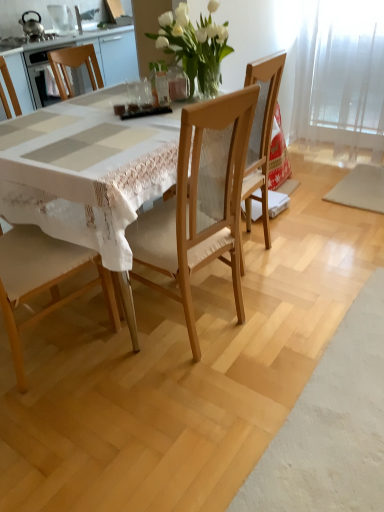
What do you see at coordinates (52, 282) in the screenshot? I see `white fabric chair at left, the second chair when ordered from right to left` at bounding box center [52, 282].

The height and width of the screenshot is (512, 384). I want to click on transparent glass door at upper right, so click(340, 76).

Describe the element at coordinates (61, 17) in the screenshot. The height and width of the screenshot is (512, 384). I see `brushed metal kettle at upper left, which is the first appliance in right-to-left order` at that location.

At what (x,y) coordinates should I click in order to perform the action: click on wooden chair at center, positioned as the 2th chair in left-to-right order. Please return your answer as a coordinate pair (x, y). Looking at the image, I should click on (261, 134).

I want to click on wooden table at center, so click(x=86, y=170).

Is point (302, 99) in front of point (57, 27)?

Yes, point (302, 99) is in front of point (57, 27).

Consider the image. Is transparent glass door at upper right positioned far away from brushed metal kettle at upper left, marked as the second appliance in a left-to-right arrangement?

transparent glass door at upper right is far away from brushed metal kettle at upper left, marked as the second appliance in a left-to-right arrangement.

From a real-world perspective, is transparent glass door at upper right over brushed metal kettle at upper left, marked as the second appliance in a left-to-right arrangement?

No, from a real-world perspective, transparent glass door at upper right is not above brushed metal kettle at upper left, marked as the second appliance in a left-to-right arrangement.

Considering the sizes of objects transparent glass door at upper right and brushed metal kettle at upper left, which is the first appliance in right-to-left order, in the image provided, who is thinner, transparent glass door at upper right or brushed metal kettle at upper left, which is the first appliance in right-to-left order,?

transparent glass door at upper right.

From a real-world perspective, is clear glass at center located beneath white glass vase at upper center?

Yes.

Is clear glass at center thinner than white glass vase at upper center?

Yes.

Is clear glass at center positioned beyond the bounds of white glass vase at upper center?

Yes.

Is clear glass at center facing towards white glass vase at upper center?

No, clear glass at center is not aimed at white glass vase at upper center.

Is clear glass at center positioned far away from wooden table at center?

No.

Based on the photo, could you tell me if clear glass at center is turned towards wooden table at center?

No, clear glass at center is not aimed at wooden table at center.

Considering the sizes of objects clear glass at center and wooden table at center in the image provided, who is bigger, clear glass at center or wooden table at center?

With larger size is wooden table at center.

From a real-world perspective, is clear glass at center positioned under wooden table at center based on gravity?

No, from a real-world perspective, clear glass at center is not below wooden table at center.

Based on the photo, from the image's perspective, between white fabric chair at left, the second chair when ordered from right to left, and brushed metal kettle at upper left, marked as the second appliance in a left-to-right arrangement, which one is located above?

From the image's view, brushed metal kettle at upper left, marked as the second appliance in a left-to-right arrangement, is above.

Considering the relative positions of white fabric chair at left, the 1th chair when ordered from left to right, and brushed metal kettle at upper left, marked as the second appliance in a left-to-right arrangement, in the image provided, is white fabric chair at left, the 1th chair when ordered from left to right, to the left or to the right of brushed metal kettle at upper left, marked as the second appliance in a left-to-right arrangement,?

white fabric chair at left, the 1th chair when ordered from left to right, is to the right of brushed metal kettle at upper left, marked as the second appliance in a left-to-right arrangement.

Can you confirm if white fabric chair at left, the second chair when ordered from right to left, is bigger than brushed metal kettle at upper left, marked as the second appliance in a left-to-right arrangement?

Indeed, white fabric chair at left, the second chair when ordered from right to left, has a larger size compared to brushed metal kettle at upper left, marked as the second appliance in a left-to-right arrangement.

Is white fabric chair at left, the 1th chair when ordered from left to right, turned away from brushed metal kettle at upper left, which is the first appliance in right-to-left order?

No, white fabric chair at left, the 1th chair when ordered from left to right, is not facing the opposite direction of brushed metal kettle at upper left, which is the first appliance in right-to-left order.

Is point (370, 130) more distant than point (25, 14)?

No, (370, 130) is in front of (25, 14).

Identify the location of glass door in front of the metallic teapot at upper left, which is counted as the 1th appliance, starting from the left. The height and width of the screenshot is (512, 384). (340, 76).

Is transparent glass door at upper right placed right next to metallic teapot at upper left, positioned as the 2th appliance in right-to-left order?

No, transparent glass door at upper right is not with metallic teapot at upper left, positioned as the 2th appliance in right-to-left order.

Is transparent glass door at upper right wider or thinner than metallic teapot at upper left, positioned as the 2th appliance in right-to-left order?

Clearly, transparent glass door at upper right has more width compared to metallic teapot at upper left, positioned as the 2th appliance in right-to-left order.

Based on their sizes in the image, would you say brushed metal kettle at upper left, which is the first appliance in right-to-left order, is bigger or smaller than white fabric chair at left, the second chair when ordered from right to left?

Clearly, brushed metal kettle at upper left, which is the first appliance in right-to-left order, is smaller in size than white fabric chair at left, the second chair when ordered from right to left.

Which is behind, point (64, 17) or point (38, 315)?

The point (64, 17) is more distant.

From the image's perspective, is brushed metal kettle at upper left, marked as the second appliance in a left-to-right arrangement, positioned above or below white fabric chair at left, the second chair when ordered from right to left?

brushed metal kettle at upper left, marked as the second appliance in a left-to-right arrangement, is above white fabric chair at left, the second chair when ordered from right to left.

From a real-world perspective, between brushed metal kettle at upper left, marked as the second appliance in a left-to-right arrangement, and transparent glass door at upper right, who is vertically higher?

brushed metal kettle at upper left, marked as the second appliance in a left-to-right arrangement, is physically above.

Which is behind, brushed metal kettle at upper left, marked as the second appliance in a left-to-right arrangement, or transparent glass door at upper right?

Positioned behind is brushed metal kettle at upper left, marked as the second appliance in a left-to-right arrangement.

Considering the sizes of objects brushed metal kettle at upper left, marked as the second appliance in a left-to-right arrangement, and transparent glass door at upper right in the image provided, who is wider, brushed metal kettle at upper left, marked as the second appliance in a left-to-right arrangement, or transparent glass door at upper right?

brushed metal kettle at upper left, marked as the second appliance in a left-to-right arrangement, is wider.

Between brushed metal kettle at upper left, which is the first appliance in right-to-left order, and transparent glass door at upper right, which one has less height?

With less height is brushed metal kettle at upper left, which is the first appliance in right-to-left order.

Identify the location of glass door below the brushed metal kettle at upper left, marked as the second appliance in a left-to-right arrangement (from a real-world perspective). This screenshot has height=512, width=384. (340, 76).

Where is `tableware on the left of white glass vase at upper center`? The image size is (384, 512). tableware on the left of white glass vase at upper center is located at coordinates (133, 95).

When comparing their distances from wooden table at center, does white fabric chair at left, the second chair when ordered from right to left, or brushed metal kettle at upper left, marked as the second appliance in a left-to-right arrangement, seem further?

Among the two, brushed metal kettle at upper left, marked as the second appliance in a left-to-right arrangement, is located further to wooden table at center.

Based on their spatial positions, is wooden chair at center, positioned as the 2th chair in left-to-right order, or white glass vase at upper center closer to clear glass at center?

Based on the image, white glass vase at upper center appears to be nearer to clear glass at center.

When comparing their distances from white fabric chair at left, the 1th chair when ordered from left to right, does wooden chair at center, which is the first chair in right-to-left order, or brushed metal kettle at upper left, which is the first appliance in right-to-left order, seem closer?

The object closer to white fabric chair at left, the 1th chair when ordered from left to right, is wooden chair at center, which is the first chair in right-to-left order.

From the image, which object appears to be nearer to transparent glass door at upper right, metallic teapot at upper left, which is counted as the 1th appliance, starting from the left, or wooden table at center?

wooden table at center.

Considering their positions, is transparent glass door at upper right positioned further to white fabric chair at left, the second chair when ordered from right to left, than brushed metal kettle at upper left, marked as the second appliance in a left-to-right arrangement?

brushed metal kettle at upper left, marked as the second appliance in a left-to-right arrangement.

Looking at the image, which one is located further to clear glass at center, wooden table at center or wooden chair at center, positioned as the 2th chair in left-to-right order?

Based on the image, wooden chair at center, positioned as the 2th chair in left-to-right order, appears to be further to clear glass at center.

Looking at this image, considering their positions, is wooden table at center positioned further to clear glass at center than metallic teapot at upper left, positioned as the 2th appliance in right-to-left order?

metallic teapot at upper left, positioned as the 2th appliance in right-to-left order.

Considering their positions, is clear glass at center positioned further to white fabric chair at left, the second chair when ordered from right to left, than metallic teapot at upper left, which is counted as the 1th appliance, starting from the left?

Based on the image, metallic teapot at upper left, which is counted as the 1th appliance, starting from the left, appears to be further to white fabric chair at left, the second chair when ordered from right to left.

The width and height of the screenshot is (384, 512). What are the coordinates of `tableware positioned between wooden chair at center, which is the first chair in right-to-left order, and brushed metal kettle at upper left, marked as the second appliance in a left-to-right arrangement, from near to far` in the screenshot? It's located at (133, 95).

The width and height of the screenshot is (384, 512). I want to click on floral arrangement between wooden table at center and transparent glass door at upper right from left to right, so click(195, 45).

The height and width of the screenshot is (512, 384). I want to click on chair situated between white glass vase at upper center and transparent glass door at upper right from left to right, so click(x=261, y=134).

This screenshot has width=384, height=512. I want to click on tableware that lies between white glass vase at upper center and wooden chair at center, which is the first chair in right-to-left order, from top to bottom, so click(x=133, y=95).